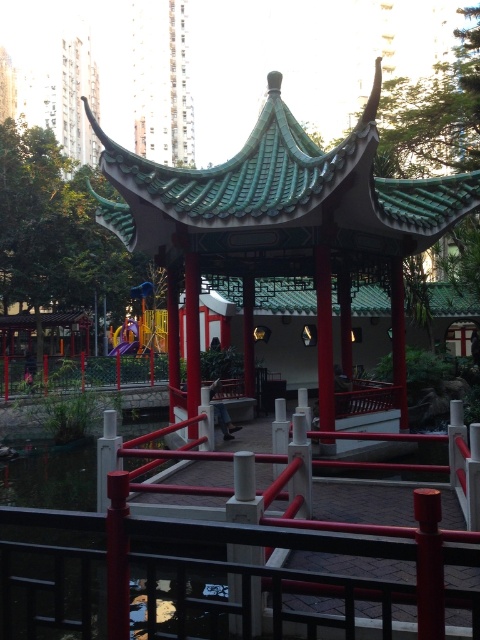
Question: Which of the following is the closest to the observer?

Choices:
 (A) (140, 204)
 (B) (263, 588)

Answer: (B)

Question: Among these objects, which one is nearest to the camera?

Choices:
 (A) green glazed tile gazebo at center
 (B) metallic red railing at center

Answer: (B)

Question: In this image, where is green glazed tile gazebo at center located relative to metallic red railing at center?

Choices:
 (A) right
 (B) left

Answer: (B)

Question: Is green glazed tile gazebo at center behind metallic red railing at center?

Choices:
 (A) no
 (B) yes

Answer: (B)

Question: Is the position of green glazed tile gazebo at center more distant than that of metallic red railing at center?

Choices:
 (A) yes
 (B) no

Answer: (A)

Question: Which of the following is the farthest from the observer?

Choices:
 (A) metallic red railing at center
 (B) green glazed tile gazebo at center

Answer: (B)